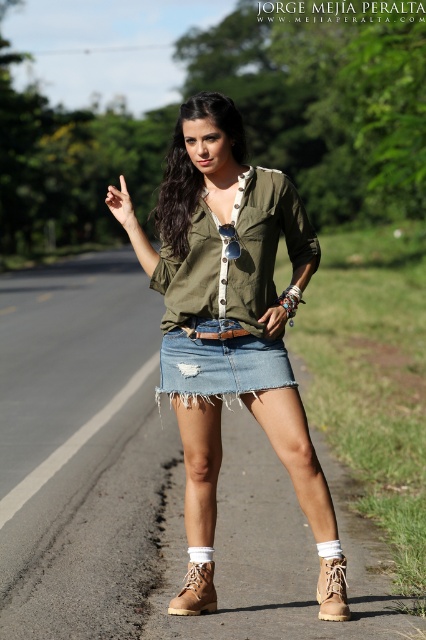
Does ripped denim skirt at center have a lesser width compared to tan leather boot at lower center?

No, ripped denim skirt at center is not thinner than tan leather boot at lower center.

What do you see at coordinates (219, 362) in the screenshot? This screenshot has width=426, height=640. I see `ripped denim skirt at center` at bounding box center [219, 362].

You are a GUI agent. You are given a task and a screenshot of the screen. Output one action in this format:
    pyautogui.click(x=<x>, y=<y>)
    Task: Click on the ripped denim skirt at center
    
    Given the screenshot: What is the action you would take?
    pyautogui.click(x=219, y=362)

Between point (184, 364) and point (325, 568), which one is positioned behind?

The point (184, 364) is more distant.

Which is more to the right, ripped denim skirt at center or tan suede boot at lower center?

From the viewer's perspective, tan suede boot at lower center appears more on the right side.

Is point (256, 369) in front of point (336, 573)?

No, it is not.

This screenshot has height=640, width=426. What are the coordinates of `ripped denim skirt at center` in the screenshot? It's located at (219, 362).

Is point (210, 163) closer to viewer compared to point (322, 593)?

No.

This screenshot has height=640, width=426. I want to click on denim skirt at center, so click(x=227, y=307).

What do you see at coordinates (227, 307) in the screenshot?
I see `denim skirt at center` at bounding box center [227, 307].

This screenshot has width=426, height=640. Identify the location of denim skirt at center. (227, 307).